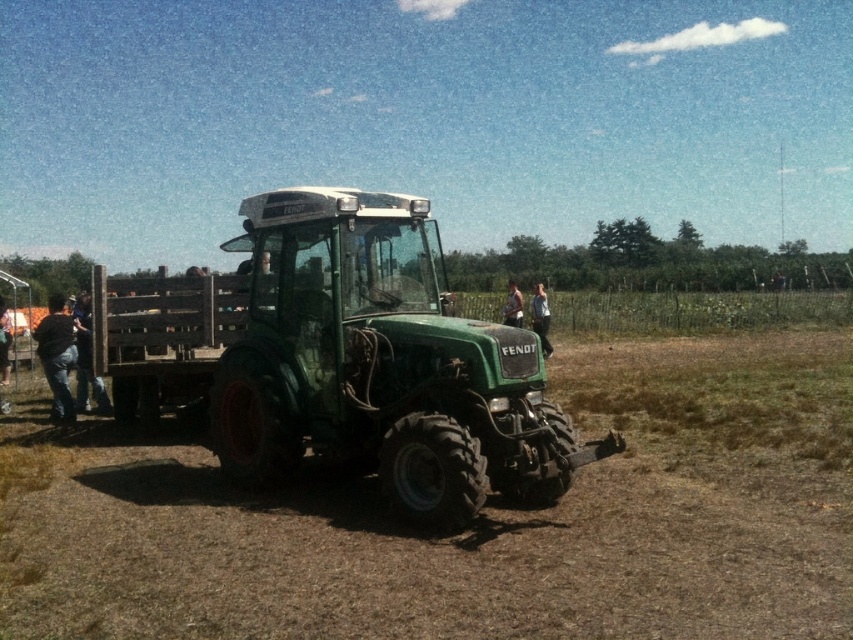
Question: Can you confirm if dull brown dirt at center is bigger than green matte tractor at center?

Choices:
 (A) yes
 (B) no

Answer: (B)

Question: Estimate the real-world distances between objects in this image. Which object is farther from the green matte tractor at center?

Choices:
 (A) denim pants at lower left
 (B) dull brown dirt at center
 (C) denim pants at left

Answer: (A)

Question: Can you confirm if denim pants at lower left is bigger than dark blue jeans at center?

Choices:
 (A) no
 (B) yes

Answer: (A)

Question: Is green matte tractor at center further to camera compared to denim pants at left?

Choices:
 (A) no
 (B) yes

Answer: (A)

Question: Which point is farther to the camera?

Choices:
 (A) dark brown leather jacket at left
 (B) denim pants at lower left
 (C) denim pants at left

Answer: (B)

Question: Which object is farther from the camera taking this photo?

Choices:
 (A) denim pants at left
 (B) light brown leather jacket at center
 (C) green matte tractor at center

Answer: (A)